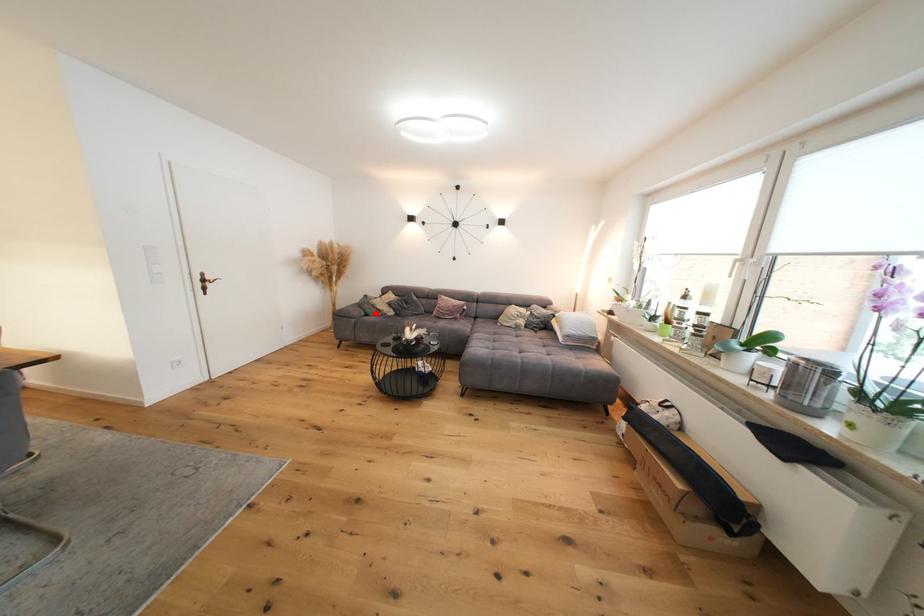
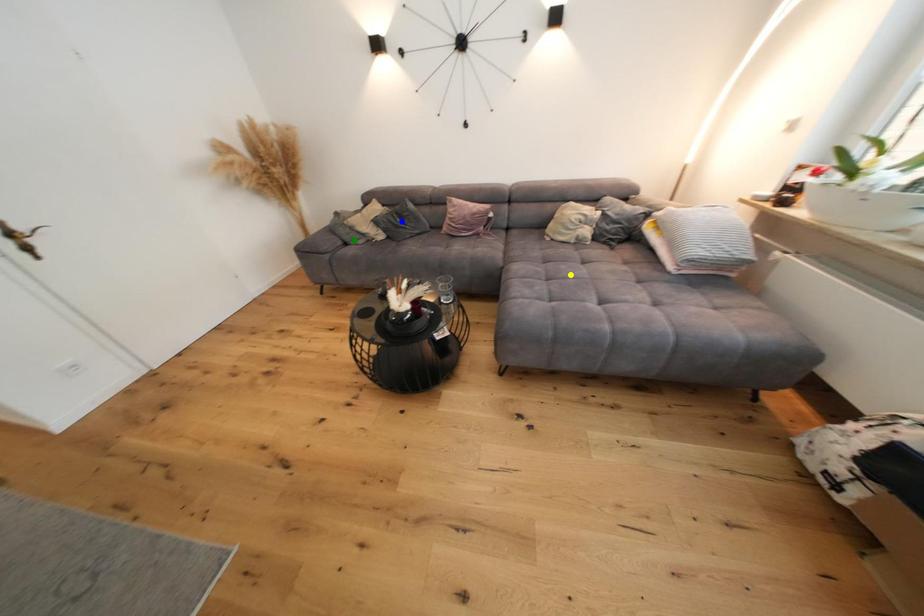
Question: I am providing you with two images of the same scene from different viewpoints. A red point is marked on the first image. You are given multiple points on the second image. In image 2, which mark is for the same physical point as the one in image 1?

Choices:
 (A) green point
 (B) blue point
 (C) yellow point

Answer: (A)